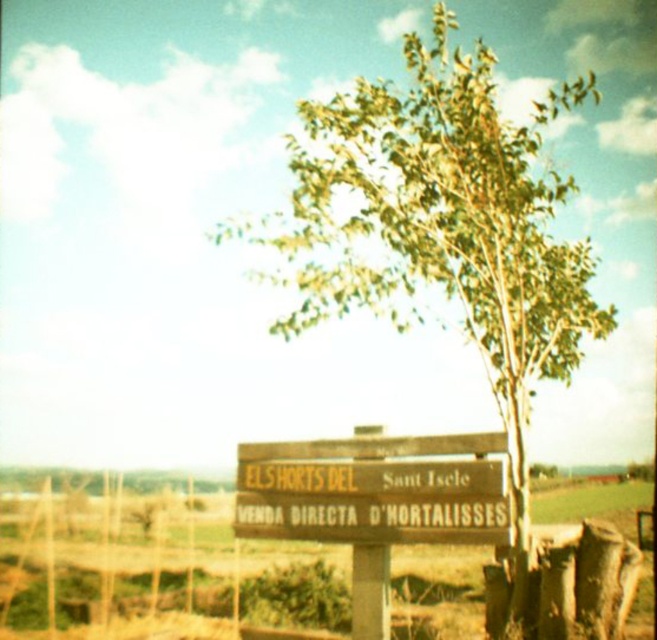
Which is below, green leafy tree at center or brown wooden signpost at center?

Positioned lower is brown wooden signpost at center.

Is point (430, 132) more distant than point (254, 598)?

No.

This screenshot has width=657, height=640. In order to click on green leafy tree at center in this screenshot , I will do `click(442, 227)`.

Is brown wooden signpost at center shorter than wooden sign at center?

Incorrect, brown wooden signpost at center's height does not fall short of wooden sign at center's.

Is point (95, 582) in front of point (382, 444)?

No, (95, 582) is behind (382, 444).

Is point (464, 564) farther from camera compared to point (323, 477)?

That is True.

Identify the location of brown wooden signpost at center. (112, 568).

How far apart are green leafy tree at center and wooden sign at center?

green leafy tree at center is 41.57 feet away from wooden sign at center.

Does green leafy tree at center have a greater width compared to wooden sign at center?

Yes, green leafy tree at center is wider than wooden sign at center.

Is point (489, 182) closer to viewer compared to point (336, 513)?

No, it is behind (336, 513).

Find the location of a particular element. green leafy tree at center is located at coordinates (442, 227).